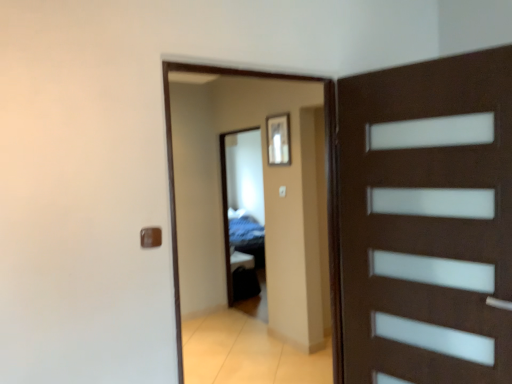
Find the location of a particular element. The height and width of the screenshot is (384, 512). free point above transparent glass door at center (from a real-world perspective) is located at coordinates (266, 64).